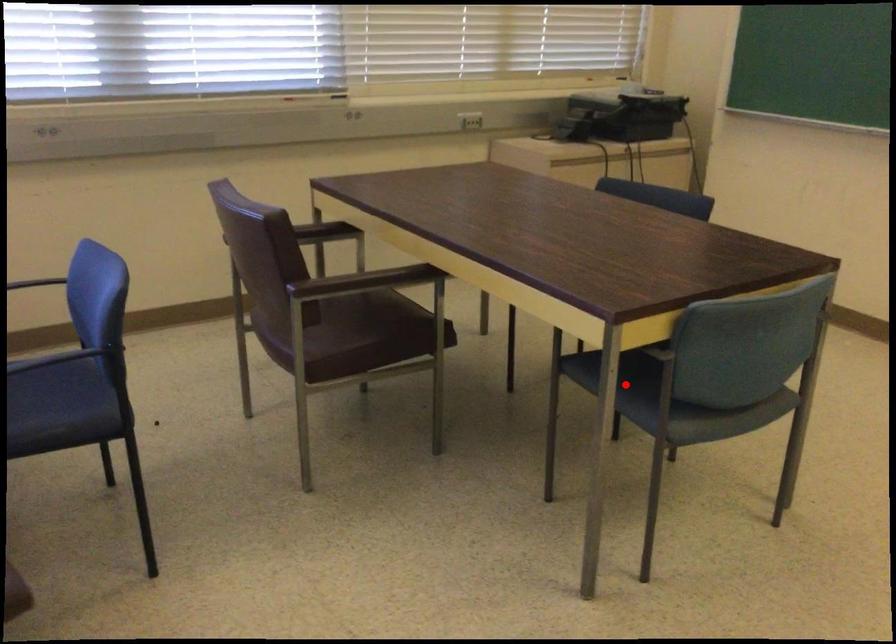
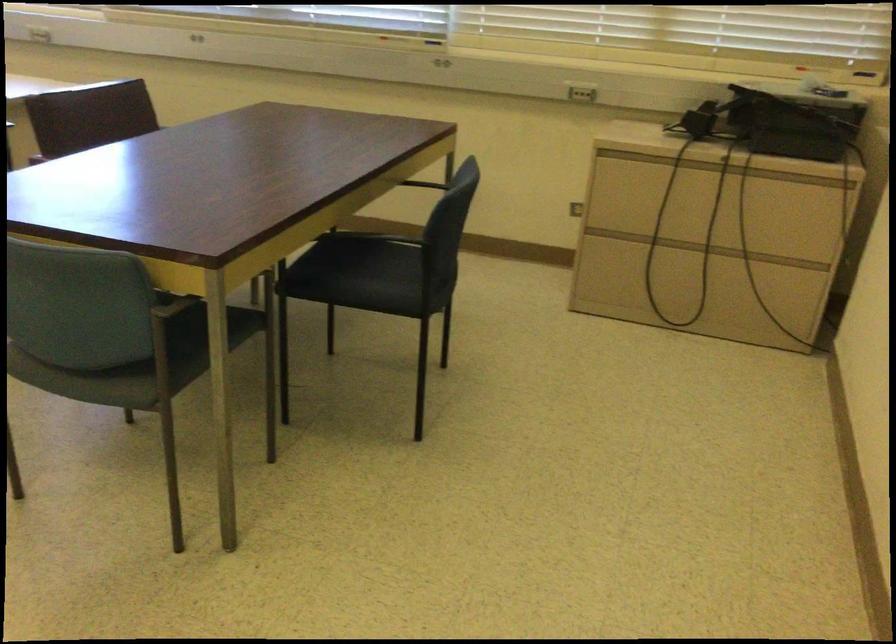
Question: I am providing you with two images of the same scene from different viewpoints. A red point is marked on the first image. At the location where the point appears in image 1, is it still visible in image 2?

Choices:
 (A) Yes
 (B) No

Answer: (B)